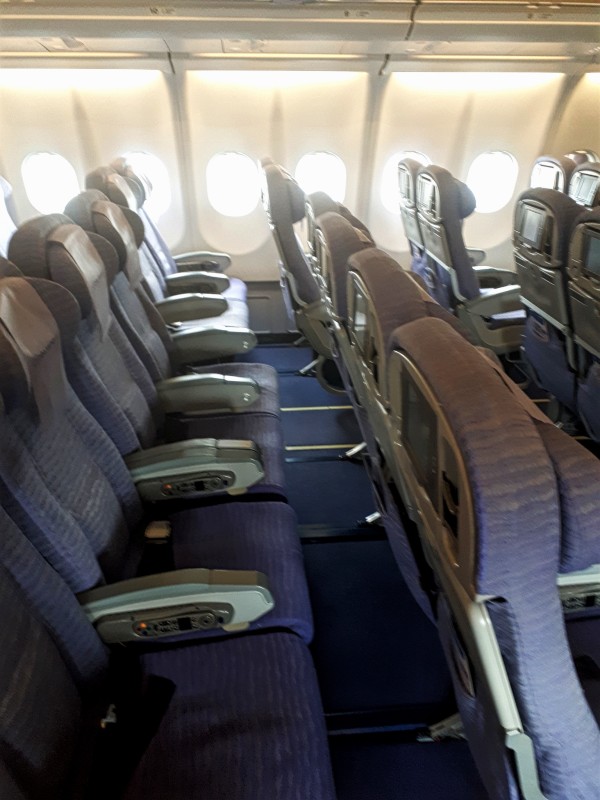
Locate an element on the screen. The height and width of the screenshot is (800, 600). windows is located at coordinates [493, 178], [386, 192], [326, 176], [238, 180], [159, 177], [53, 182].